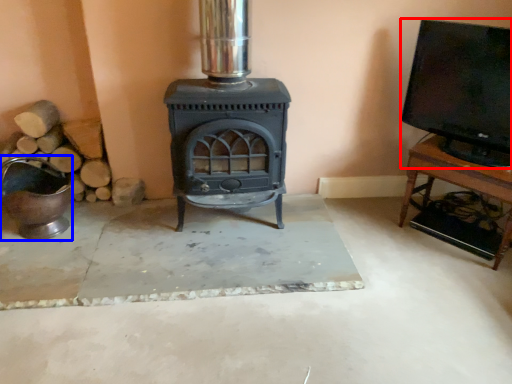
Question: Which object appears farthest to the camera in this image, wide (highlighted by a red box) or appliance (highlighted by a blue box)?

Choices:
 (A) wide
 (B) appliance

Answer: (B)